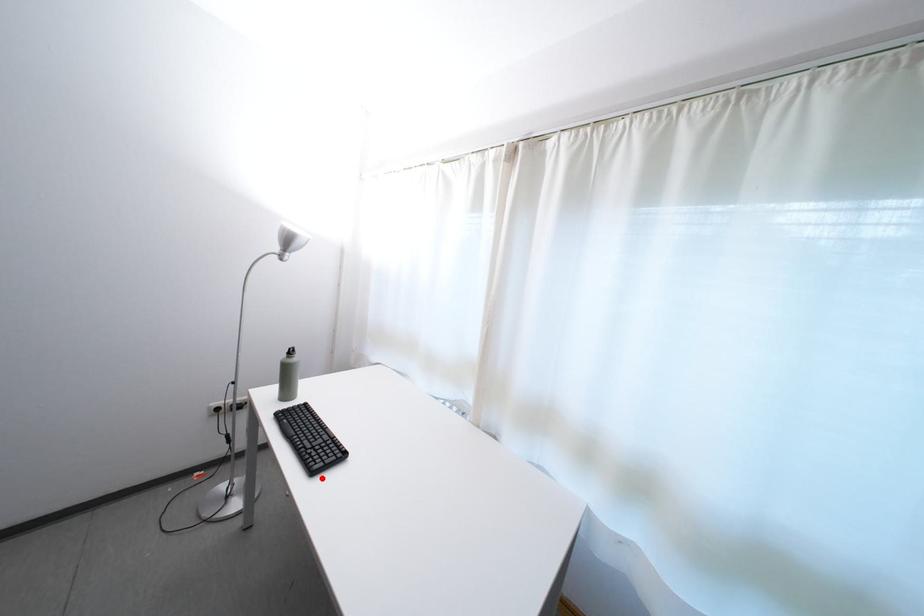
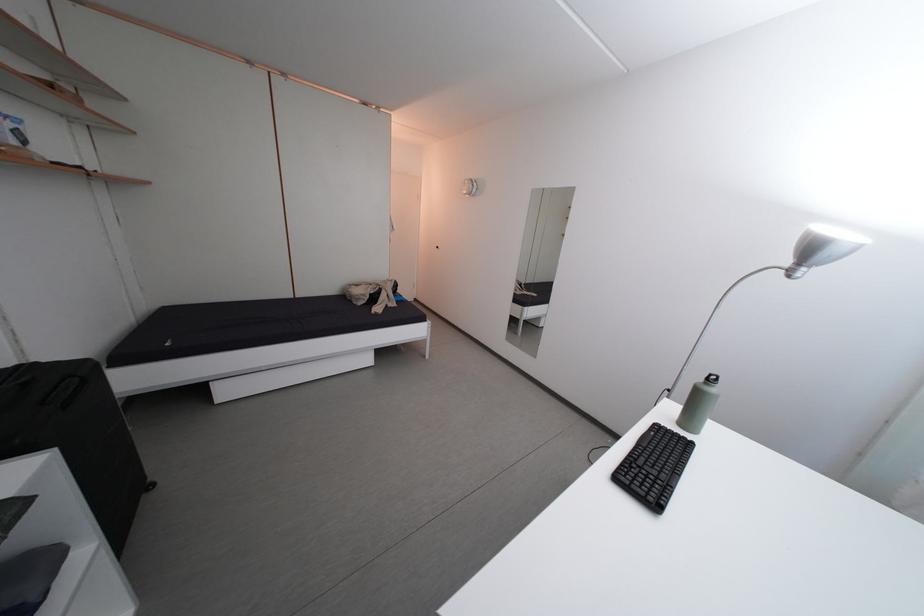
Locate, in the second image, the point that corresponds to the highlighted location in the first image.

(626, 485)